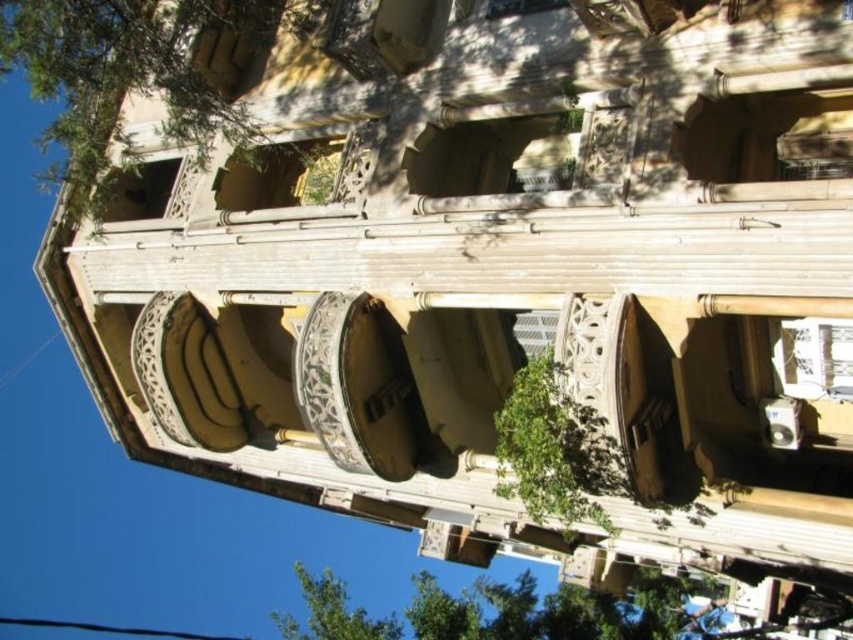
Question: Based on their relative distances, which object is farther from the green leafy tree at upper left?

Choices:
 (A) green leafy tree at center
 (B) green leafy tree at lower center

Answer: (B)

Question: Is green leafy tree at center further to camera compared to green leafy tree at upper center?

Choices:
 (A) no
 (B) yes

Answer: (A)

Question: Which point appears farthest from the camera in this image?

Choices:
 (A) (310, 621)
 (B) (585, 492)
 (C) (149, 92)

Answer: (A)

Question: Which point is farther from the camera taking this photo?

Choices:
 (A) (526, 371)
 (B) (361, 636)

Answer: (B)

Question: Is green leafy tree at lower center to the right of green leafy tree at center from the viewer's perspective?

Choices:
 (A) no
 (B) yes

Answer: (A)

Question: Does green leafy tree at upper left have a greater width compared to green leafy tree at center?

Choices:
 (A) yes
 (B) no

Answer: (A)